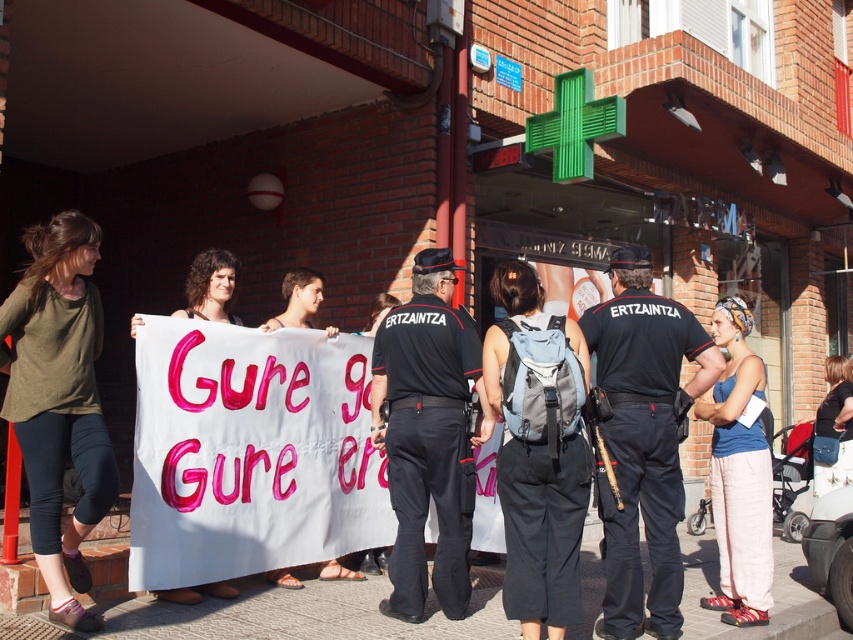
Question: Considering the relative positions of green cotton shirt at center and gray fabric backpack at center in the image provided, where is green cotton shirt at center located with respect to gray fabric backpack at center?

Choices:
 (A) right
 (B) left

Answer: (B)

Question: Which point is closer to the camera?

Choices:
 (A) (672, 374)
 (B) (22, 625)
 (C) (33, 556)

Answer: (B)

Question: Which point is farther to the camera?

Choices:
 (A) (585, 440)
 (B) (410, 534)
 (C) (654, 387)
 (D) (485, 628)

Answer: (B)

Question: In this image, where is black uniform at center located relative to green cotton shirt at center?

Choices:
 (A) above
 (B) below

Answer: (B)

Question: Which object appears closest to the camera in this image?

Choices:
 (A) black uniform at center
 (B) blue cotton tank top at center
 (C) black uniform pants at center
 (D) green cotton shirt at center

Answer: (D)

Question: Can you confirm if gray fabric backpack at center is positioned to the right of blue cotton tank top at center?

Choices:
 (A) yes
 (B) no

Answer: (B)